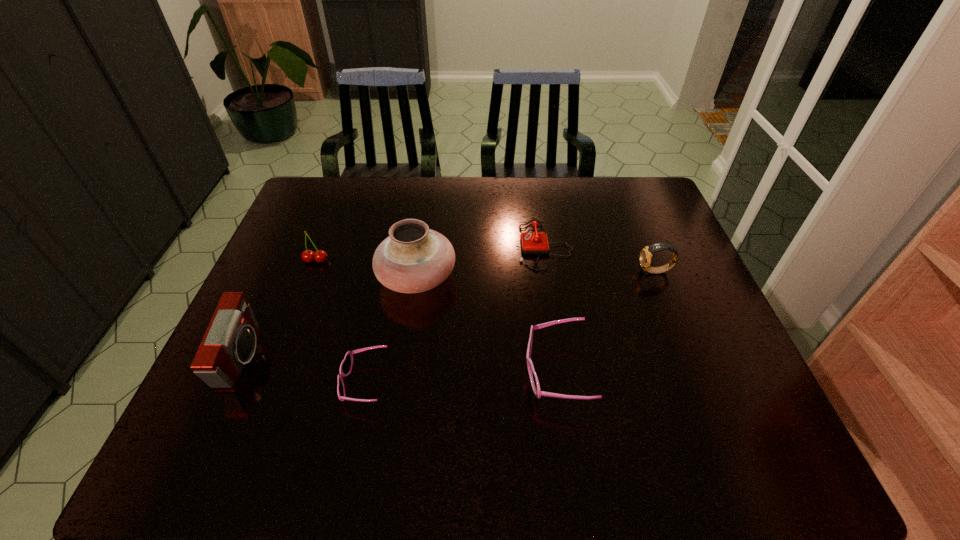
Please point out where to position a new sunglasses on the right to maintain spacing. Please provide its 2D coordinates. Your answer should be formatted as a tuple, i.e. [(x, y)], where the tuple contains the x and y coordinates of a point satisfying the conditions above.

[(740, 362)]